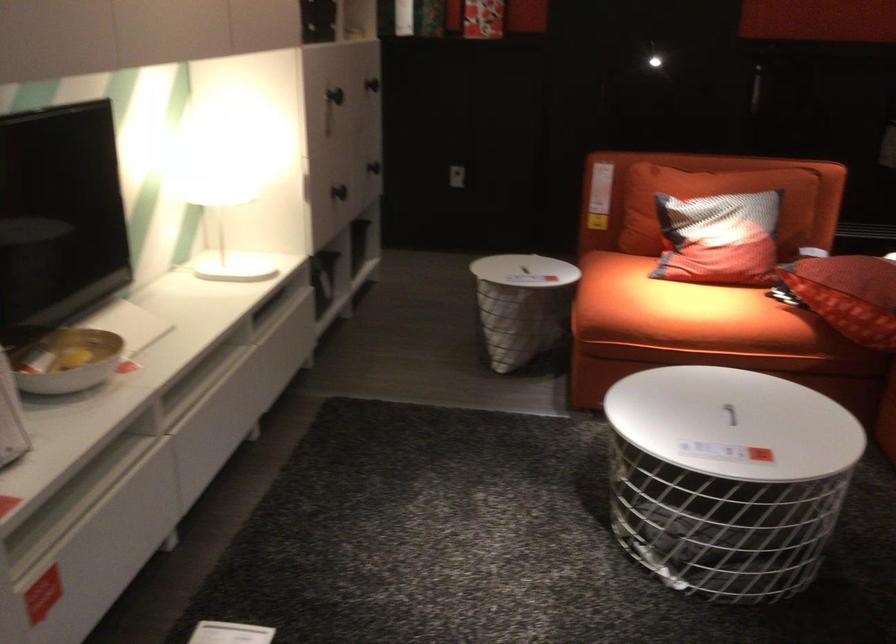
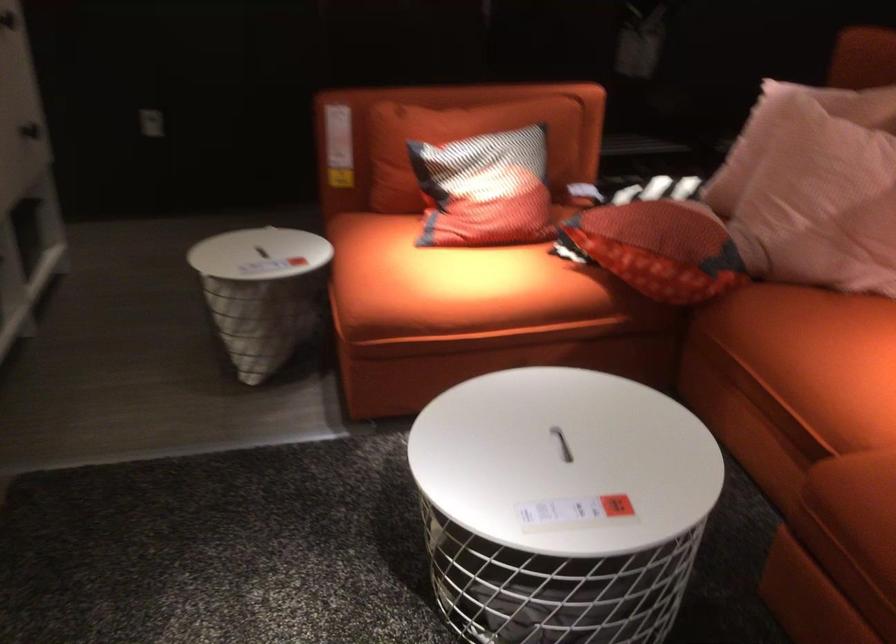
Question: The first image is from the beginning of the video and the second image is from the end. How did the camera likely rotate when shooting the video?

Choices:
 (A) Left
 (B) Right
 (C) Up
 (D) Down

Answer: (B)